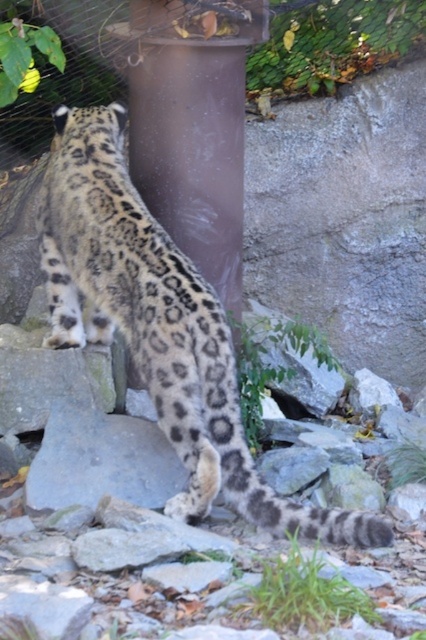
Question: Observing the image, what is the correct spatial positioning of spotted fur snow leopard at center in reference to brushed metal fence at upper center?

Choices:
 (A) below
 (B) above

Answer: (A)

Question: Observing the image, what is the correct spatial positioning of brown textured pillar at center in reference to brushed metal fence at upper center?

Choices:
 (A) below
 (B) above

Answer: (A)

Question: Among these objects, which one is farthest from the camera?

Choices:
 (A) brown textured pillar at center
 (B) spotted fur snow leopard at center
 (C) brushed metal fence at upper center

Answer: (C)

Question: Which point is closer to the camera?

Choices:
 (A) (271, 22)
 (B) (210, 54)

Answer: (B)

Question: Which object is the farthest from the brushed metal fence at upper center?

Choices:
 (A) spotted fur snow leopard at center
 (B) brown textured pillar at center

Answer: (A)

Question: In this image, where is spotted fur snow leopard at center located relative to brushed metal fence at upper center?

Choices:
 (A) right
 (B) left

Answer: (B)